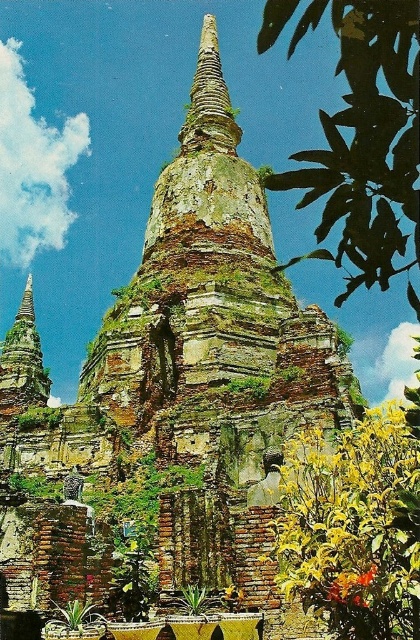
You are standing in front of the ancient temple and notice a green leafy plant at upper right. Based on its position, can you determine if it is closer to the top or the bottom of the temple structure?

The green leafy plant at upper right is located at point coordinates indicating it is closer to the top of the temple structure.